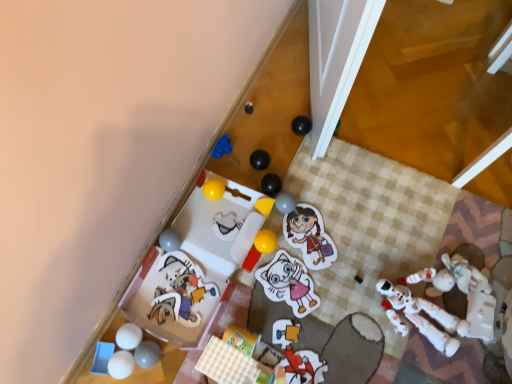
Image resolution: width=512 pixels, height=384 pixels. In order to click on free space on the front side of white plastic toy at lower right, the fifteenth toy viewed from the left in this screenshot , I will do `click(413, 362)`.